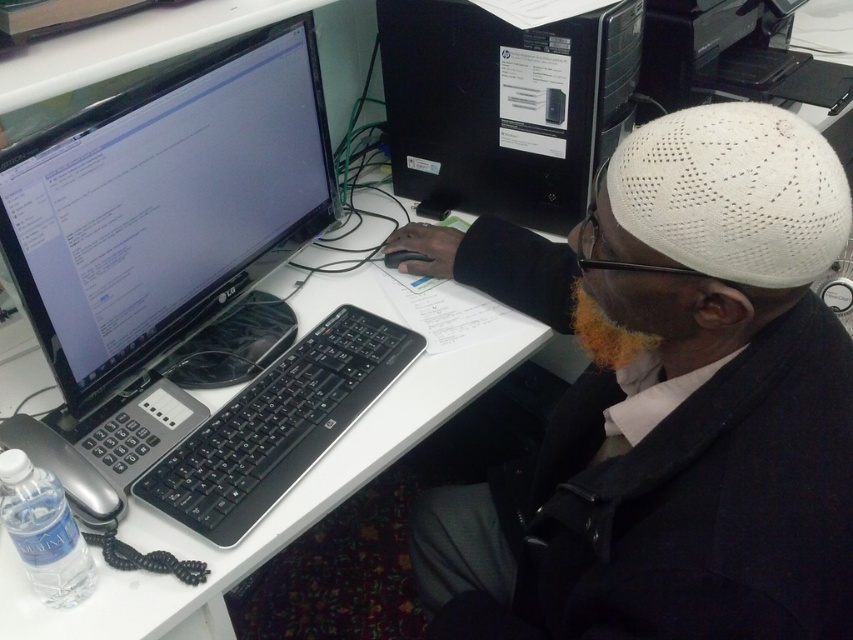
You are a delivery person who needs to place a 24 inch box between the white knit cap at upper right and the black glossy monitor at upper left on the desk. Can the box fit between them without overlapping either object?

The white knit cap at upper right and the black glossy monitor at upper left are 23.39 inches apart. Since the box is 24 inches long, it cannot fit between them without overlapping either object.

You are setting up a new desk arrangement and want to place a plant between the black glossy monitor at upper left and the black plastic computer tower at center. Since the monitor is taller, where should you position the plant to ensure it doesn

The black glossy monitor at upper left is taller than the black plastic computer tower at center, so positioning the plant closer to the computer tower would balance the visual weight, as the monitor already draws attention with its height.

You are setting up a webcam for video calls in the workspace shown. The camera must be placed exactly 30 inches away from the black glossy monitor at upper left to ensure optimal framing. Is the current placement of the camera meeting this requirement?

The camera is 33.12 inches away from the black glossy monitor at upper left, which is 3.12 inches beyond the required 30 inches. To meet the requirement, the camera should be moved closer by approximately 3.12 inches.